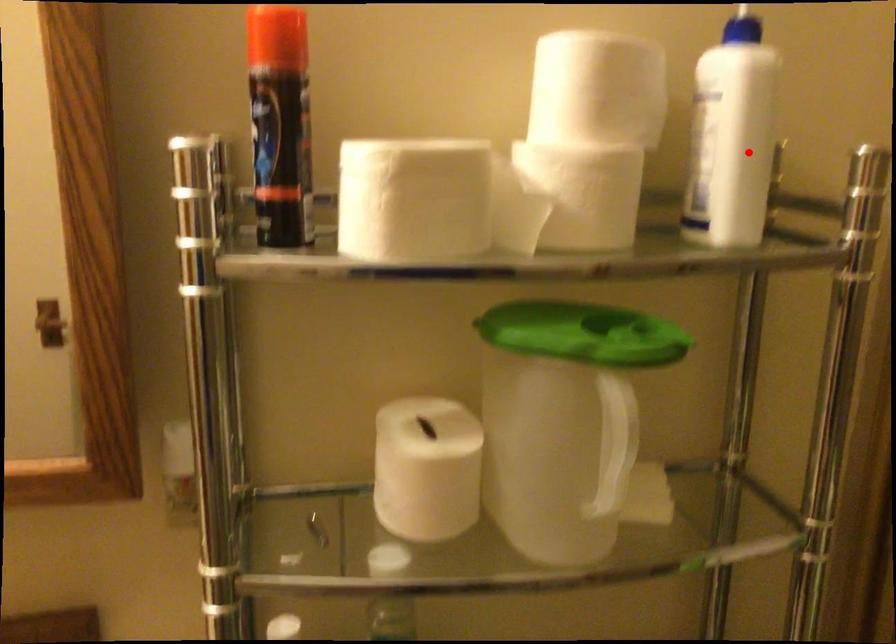
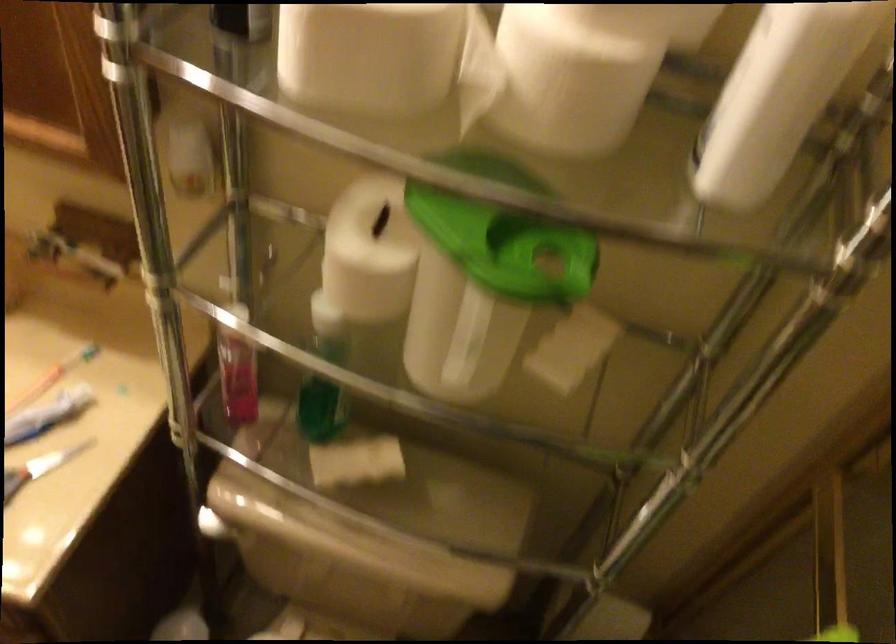
The point at the highlighted location is marked in the first image. Where is the corresponding point in the second image?

(778, 96)